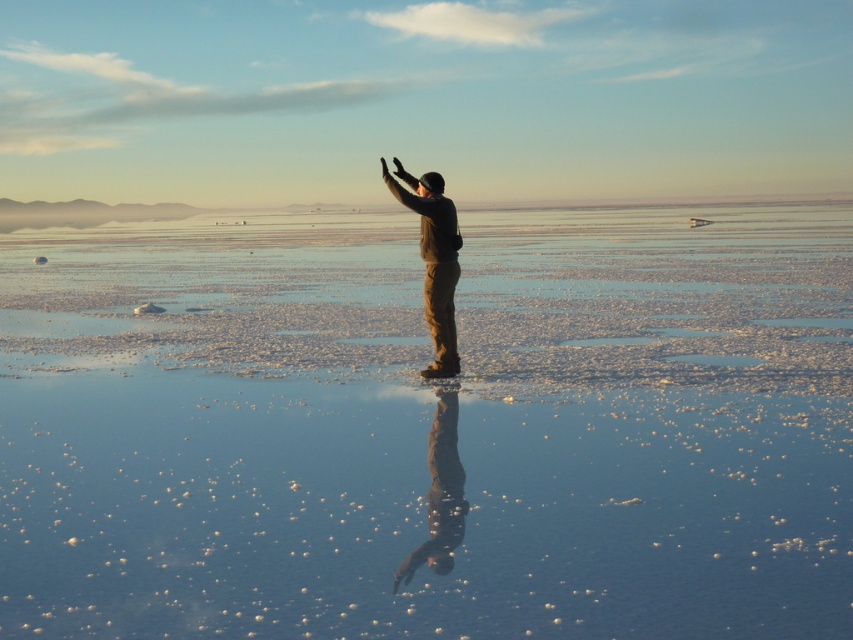
You are standing at point (437, 196) and want to walk to the person in the center of the image. Which direction should you move relative to point (328, 636)?

You should move towards point (328, 636) because it is in front of point (437, 196), meaning it is closer to the person in the center of the image.

In the scene shown: You are standing at the edge of a reflective salt flat. You see a point marked at coordinates (428, 426). According to the scene, where exactly is this point located?

The point (428, 426) is on clear glass water at center.